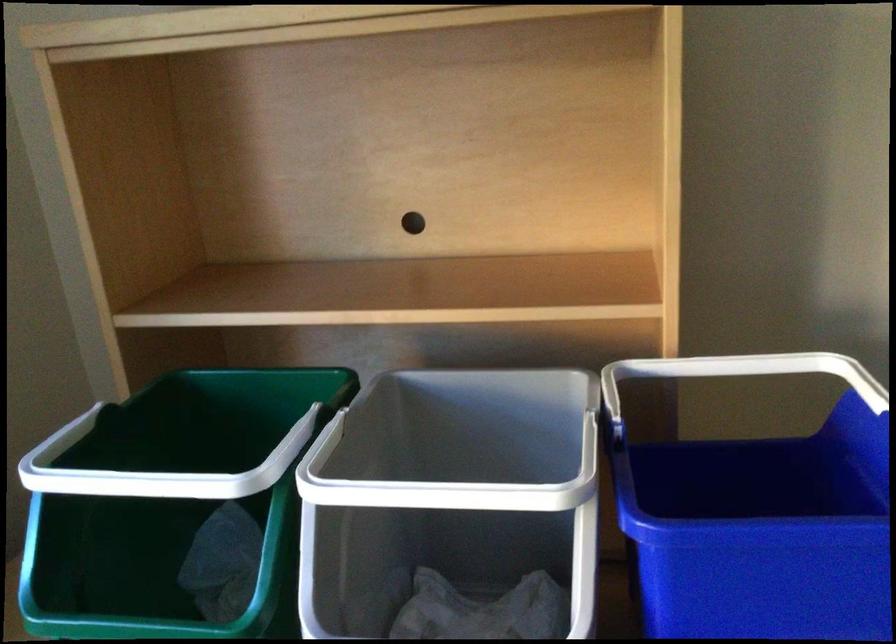
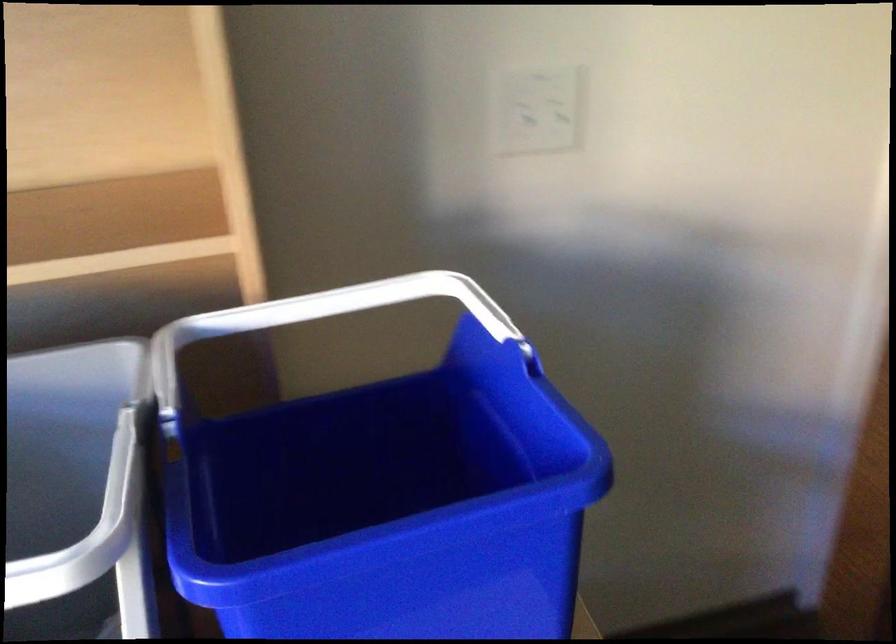
Question: How did the camera likely rotate?

Choices:
 (A) Left
 (B) Right
 (C) Up
 (D) Down

Answer: (B)